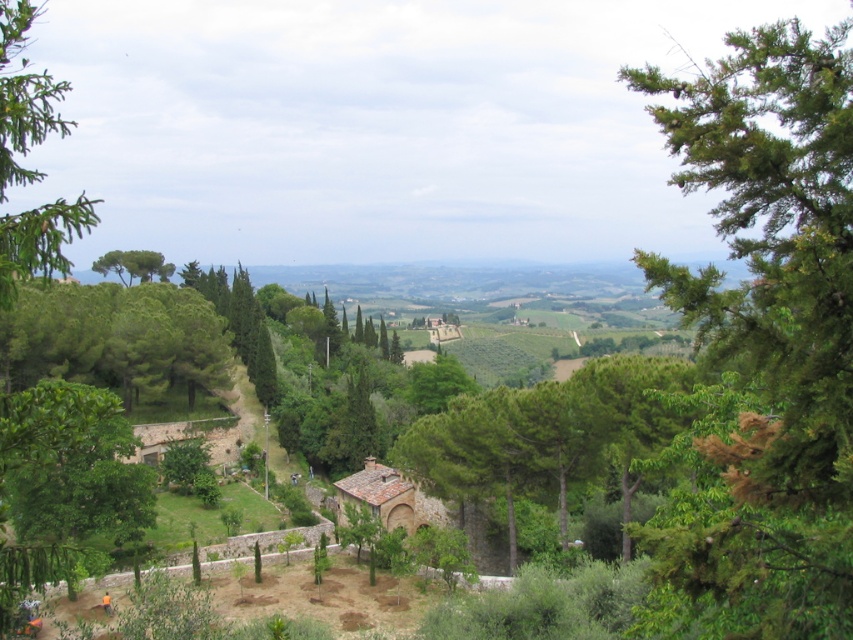
Who is taller, green leafy tree at right or green needle-like at left?

green needle-like at left

Is green leafy tree at right thinner than green needle-like at left?

Yes.

Locate an element on the screen. green leafy tree at right is located at coordinates (764, 340).